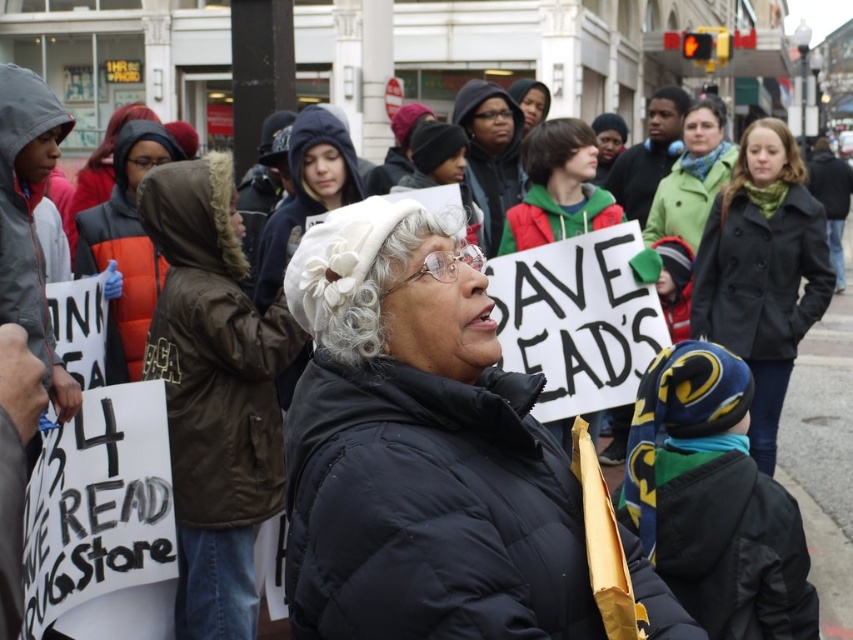
Between orange puffer jacket at left and blonde synthetic wig at upper right, which one appears on the right side from the viewer's perspective?

From the viewer's perspective, blonde synthetic wig at upper right appears more on the right side.

Consider the image. Which of these two, orange puffer jacket at left or blonde synthetic wig at upper right, stands taller?

With more height is blonde synthetic wig at upper right.

Describe the element at coordinates (126, 246) in the screenshot. I see `orange puffer jacket at left` at that location.

Locate an element on the screen. orange puffer jacket at left is located at coordinates (126, 246).

Is black puffy coat at center above dark gray wool coat at center?

No.

Can you confirm if black puffy coat at center is shorter than dark gray wool coat at center?

Indeed, black puffy coat at center has a lesser height compared to dark gray wool coat at center.

Image resolution: width=853 pixels, height=640 pixels. Describe the element at coordinates (421, 449) in the screenshot. I see `black puffy coat at center` at that location.

I want to click on black puffy coat at center, so click(x=421, y=449).

Can you confirm if white fluffy wig at center is bigger than fuzzy brown wig at upper left?

No.

Measure the distance from white fluffy wig at center to fuzzy brown wig at upper left.

A distance of 4.93 meters exists between white fluffy wig at center and fuzzy brown wig at upper left.

Find the location of `white fluffy wig at center`. white fluffy wig at center is located at coordinates (361, 269).

This screenshot has width=853, height=640. What are the coordinates of `white fluffy wig at center` in the screenshot? It's located at (361, 269).